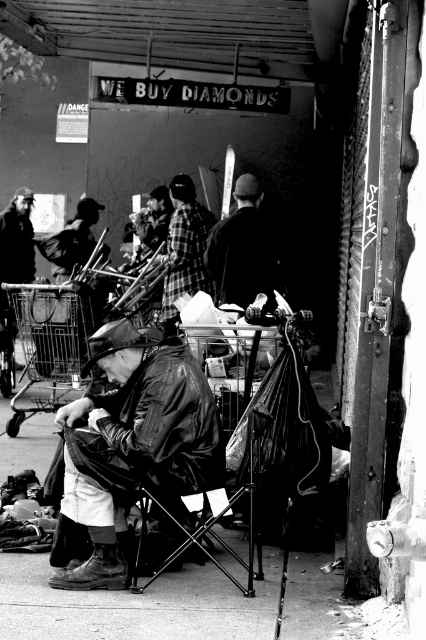
You are a fashion designer observing the scene. You notice the dark fabric jacket at center and the plaid fabric shirt at center. Which clothing item is closer to the viewer?

The plaid fabric shirt at center is closer to the viewer because the dark fabric jacket at center is positioned under it.